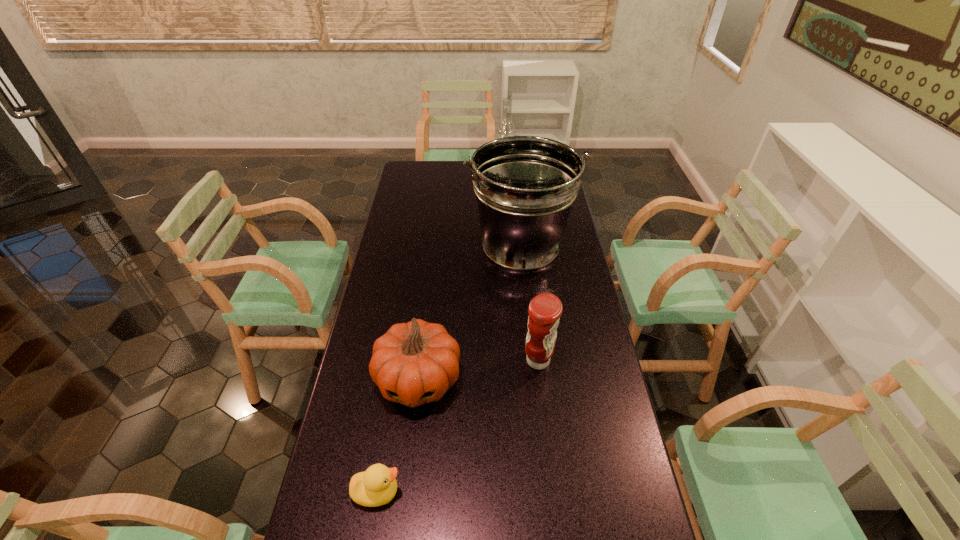
This screenshot has height=540, width=960. Find the location of `bucket`. bucket is located at coordinates (525, 186).

Image resolution: width=960 pixels, height=540 pixels. What are the coordinates of `the farthest object` in the screenshot? It's located at (506, 128).

You are a GUI agent. You are given a task and a screenshot of the screen. Output one action in this format:
    pyautogui.click(x=<x>, y=<y>)
    Task: Click on the condiment
    
    Given the screenshot: What is the action you would take?
    pyautogui.click(x=545, y=310)

This screenshot has height=540, width=960. What are the coordinates of `the second shortest object` in the screenshot? It's located at (414, 363).

Where is `duckling`? Image resolution: width=960 pixels, height=540 pixels. duckling is located at coordinates (376, 486).

The width and height of the screenshot is (960, 540). Identify the location of the shortest object. (376, 486).

Where is `vacant point located on the back of the bucket`? The width and height of the screenshot is (960, 540). vacant point located on the back of the bucket is located at coordinates (516, 208).

Image resolution: width=960 pixels, height=540 pixels. What are the coordinates of `vacant region located 0.320m on the front of the farthest object` in the screenshot? It's located at (508, 240).

The height and width of the screenshot is (540, 960). Identify the location of vacant point located on the front of the condiment. tap(552, 479).

The height and width of the screenshot is (540, 960). I want to click on vacant region located 0.150m on the face of the fourth tallest object, so click(x=407, y=474).